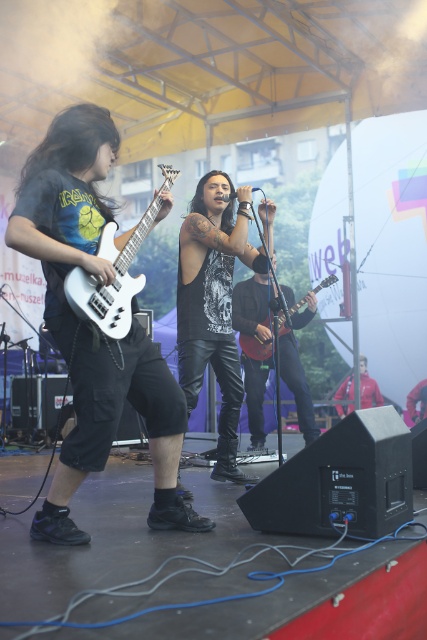
What is the object located at point (116, 429)?

The object located at point (116, 429) is the matte black guitar at left.

You are a stagehand who needs to move a 3.5 feet wide equipment case between the black leather guitar at center and the red jacket at center. Can you fit the equipment case between them without moving either object?

The distance between the black leather guitar at center and the red jacket at center is 4.22 feet. Since the equipment case is 3.5 feet wide, it can fit between them as the available space is wider than the case.

You are a photographer at the live music performance. You need to capture a closeup shot of both the red jacket at center and the dark gray leather jacket at center. Which jacket will appear larger in the photo?

The red jacket at center will appear larger in the photo because it has a larger size compared to the dark gray leather jacket at center.